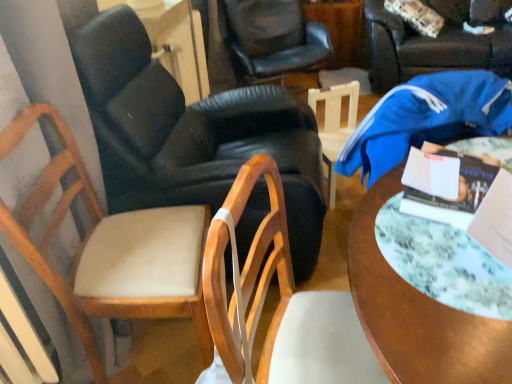
The width and height of the screenshot is (512, 384). Find the location of `wooden round table at center`. wooden round table at center is located at coordinates (417, 314).

This screenshot has width=512, height=384. What do you see at coordinates (447, 184) in the screenshot? I see `hardcover book at center right` at bounding box center [447, 184].

At what (x,y) coordinates should I click in order to perform the action: click on blue fabric chair at center, the 1th chair positioned from the right. Please return your answer as a coordinate pair (x, y). Looking at the image, I should click on (431, 45).

Measure the distance between light brown wood chair at left, which is counted as the sixth chair, starting from the right, and camera.

light brown wood chair at left, which is counted as the sixth chair, starting from the right, and camera are 37.49 inches apart from each other.

This screenshot has width=512, height=384. What do you see at coordinates (111, 249) in the screenshot?
I see `light brown wood chair at left, which is counted as the sixth chair, starting from the right` at bounding box center [111, 249].

Where is `black leather chair at center, the fourth chair from the right`? This screenshot has height=384, width=512. black leather chair at center, the fourth chair from the right is located at coordinates (274, 39).

Considering the relative sizes of white wood chair at center, which is the 5th chair from left to right, and leather armchair at center, the fifth chair viewed from the right, in the image provided, is white wood chair at center, which is the 5th chair from left to right, taller than leather armchair at center, the fifth chair viewed from the right,?

No.

Considering the positions of objects white wood chair at center, arranged as the 2th chair when viewed from the right, and leather armchair at center, the fifth chair viewed from the right, in the image provided, who is behind, white wood chair at center, arranged as the 2th chair when viewed from the right, or leather armchair at center, the fifth chair viewed from the right,?

white wood chair at center, arranged as the 2th chair when viewed from the right, is behind.

Which object is thinner, white wood chair at center, which is the 5th chair from left to right, or leather armchair at center, the fifth chair viewed from the right?

Thinner between the two is white wood chair at center, which is the 5th chair from left to right.

Who is bigger, white wood chair at center, arranged as the 2th chair when viewed from the right, or leather armchair at center, the fifth chair viewed from the right?

With larger size is leather armchair at center, the fifth chair viewed from the right.

Considering the relative sizes of hardcover book at center right and blue fabric chair at center, the 6th chair positioned from the left, in the image provided, is hardcover book at center right wider than blue fabric chair at center, the 6th chair positioned from the left,?

In fact, hardcover book at center right might be narrower than blue fabric chair at center, the 6th chair positioned from the left.

Considering the positions of objects hardcover book at center right and blue fabric chair at center, the 1th chair positioned from the right, in the image provided, who is in front, hardcover book at center right or blue fabric chair at center, the 1th chair positioned from the right,?

hardcover book at center right is more forward.

Based on their positions, is hardcover book at center right located to the left or right of blue fabric chair at center, the 1th chair positioned from the right?

hardcover book at center right is to the left of blue fabric chair at center, the 1th chair positioned from the right.

Which of these two, hardcover book at center right or blue fabric chair at center, the 6th chair positioned from the left, is bigger?

blue fabric chair at center, the 6th chair positioned from the left, is bigger.

Is hardcover book at center right looking in the opposite direction of wooden chair at center, the 3th chair from the right?

Yes.

Is hardcover book at center right bigger than wooden chair at center, which ranks as the 4th chair in left-to-right order?

No, hardcover book at center right is not bigger than wooden chair at center, which ranks as the 4th chair in left-to-right order.

From a real-world perspective, is hardcover book at center right below wooden chair at center, the 3th chair from the right?

Incorrect, from a real-world perspective, hardcover book at center right is higher than wooden chair at center, the 3th chair from the right.

Can you confirm if hardcover book at center right is positioned to the left of wooden chair at center, which ranks as the 4th chair in left-to-right order?

No, hardcover book at center right is not to the left of wooden chair at center, which ranks as the 4th chair in left-to-right order.

Could you tell me if black leather chair at center, placed as the third chair when sorted from left to right, is turned towards wooden chair at center, the 3th chair from the right?

Yes, black leather chair at center, placed as the third chair when sorted from left to right, is facing wooden chair at center, the 3th chair from the right.

From the image's perspective, is black leather chair at center, the fourth chair from the right, above wooden chair at center, the 3th chair from the right?

Yes.

Looking at the image, does black leather chair at center, the fourth chair from the right, seem bigger or smaller compared to wooden chair at center, which ranks as the 4th chair in left-to-right order?

In the image, black leather chair at center, the fourth chair from the right, appears to be larger than wooden chair at center, which ranks as the 4th chair in left-to-right order.

Between wooden chair at center, the 3th chair from the right, and white wood chair at center, which is the 5th chair from left to right, which one is positioned behind?

white wood chair at center, which is the 5th chair from left to right, is further away from the camera.

In the scene shown: From a real-world perspective, is wooden chair at center, the 3th chair from the right, positioned above or below white wood chair at center, arranged as the 2th chair when viewed from the right?

wooden chair at center, the 3th chair from the right, is above white wood chair at center, arranged as the 2th chair when viewed from the right.

Looking at this image, can you confirm if wooden chair at center, which ranks as the 4th chair in left-to-right order, is positioned to the right of white wood chair at center, arranged as the 2th chair when viewed from the right?

No, wooden chair at center, which ranks as the 4th chair in left-to-right order, is not to the right of white wood chair at center, arranged as the 2th chair when viewed from the right.

Can you confirm if wooden chair at center, which ranks as the 4th chair in left-to-right order, is smaller than white wood chair at center, arranged as the 2th chair when viewed from the right?

Actually, wooden chair at center, which ranks as the 4th chair in left-to-right order, might be larger than white wood chair at center, arranged as the 2th chair when viewed from the right.

The image size is (512, 384). I want to click on the 2nd chair directly beneath the wooden round table at center (from a real-world perspective), so click(x=335, y=126).

Between wooden round table at center and white wood chair at center, arranged as the 2th chair when viewed from the right, which one appears on the right side from the viewer's perspective?

wooden round table at center.

Is the depth of wooden round table at center less than that of white wood chair at center, which is the 5th chair from left to right?

That is True.

From the picture: From a real-world perspective, which object rests below the other?

In real-world perspective, wooden chair at center, the 3th chair from the right, is lower.

Does wooden chair at center, which ranks as the 4th chair in left-to-right order, appear on the right side of leather armchair at center, which appears as the second chair when viewed from the left?

Yes.

Identify the location of the 2nd chair directly beneath the leather armchair at center, which appears as the second chair when viewed from the left (from a real-world perspective). pos(280,302).

Is wooden chair at center, the 3th chair from the right, thinner than leather armchair at center, which appears as the second chair when viewed from the left?

Yes.

What are the coordinates of `the 1st chair in front of the white wood chair at center, which is the 5th chair from left to right, counting from the anchor's position` in the screenshot? It's located at (192, 134).

Identify the location of paperback book below the blue fabric chair at center, the 6th chair positioned from the left (from the image's perspective). The height and width of the screenshot is (384, 512). coord(447,184).

Estimate the real-world distances between objects in this image. Which object is further from hardcover book at center right, wooden round table at center or wooden chair at center, the 3th chair from the right?

wooden chair at center, the 3th chair from the right, lies further to hardcover book at center right than the other object.

Looking at the image, which one is located further to black leather chair at center, the fourth chair from the right, leather armchair at center, the fifth chair viewed from the right, or light brown wood chair at left, which ranks as the 1th chair in left-to-right order?

light brown wood chair at left, which ranks as the 1th chair in left-to-right order.

Considering their positions, is hardcover book at center right positioned closer to black leather chair at center, the fourth chair from the right, than white wood chair at center, which is the 5th chair from left to right?

white wood chair at center, which is the 5th chair from left to right.

Considering their positions, is hardcover book at center right positioned closer to black leather chair at center, the fourth chair from the right, than light brown wood chair at left, which is counted as the sixth chair, starting from the right?

light brown wood chair at left, which is counted as the sixth chair, starting from the right, is positioned closer to the anchor black leather chair at center, the fourth chair from the right.

Considering their positions, is light brown wood chair at left, which ranks as the 1th chair in left-to-right order, positioned further to hardcover book at center right than wooden chair at center, the 3th chair from the right?

The object further to hardcover book at center right is light brown wood chair at left, which ranks as the 1th chair in left-to-right order.

Estimate the real-world distances between objects in this image. Which object is closer to blue fabric chair at center, the 6th chair positioned from the left, black leather chair at center, placed as the third chair when sorted from left to right, or wooden round table at center?

Based on the image, black leather chair at center, placed as the third chair when sorted from left to right, appears to be nearer to blue fabric chair at center, the 6th chair positioned from the left.

From the image, which object appears to be nearer to wooden round table at center, hardcover book at center right or black leather chair at center, the fourth chair from the right?

The object closer to wooden round table at center is hardcover book at center right.

When comparing their distances from light brown wood chair at left, which ranks as the 1th chair in left-to-right order, does leather armchair at center, the fifth chair viewed from the right, or wooden round table at center seem further?

wooden round table at center is positioned further to the anchor light brown wood chair at left, which ranks as the 1th chair in left-to-right order.

You are a GUI agent. You are given a task and a screenshot of the screen. Output one action in this format:
    pyautogui.click(x=<x>, y=<y>)
    Task: Click on the chair between leather armchair at center, which appears as the second chair when viewed from the left, and wooden chair at center, which ranks as the 4th chair in left-to-right order, vertically
    The height and width of the screenshot is (384, 512).
    Given the screenshot: What is the action you would take?
    pyautogui.click(x=111, y=249)

Locate an element on the screen. chair positioned between leather armchair at center, which appears as the second chair when viewed from the left, and black leather chair at center, the fourth chair from the right, from near to far is located at coordinates (335, 126).

Identify the location of paperback book between leather armchair at center, which appears as the second chair when viewed from the left, and wooden round table at center. click(x=447, y=184).

This screenshot has height=384, width=512. Identify the location of chair positioned between light brown wood chair at left, which ranks as the 1th chair in left-to-right order, and white wood chair at center, which is the 5th chair from left to right, from near to far. (192, 134).